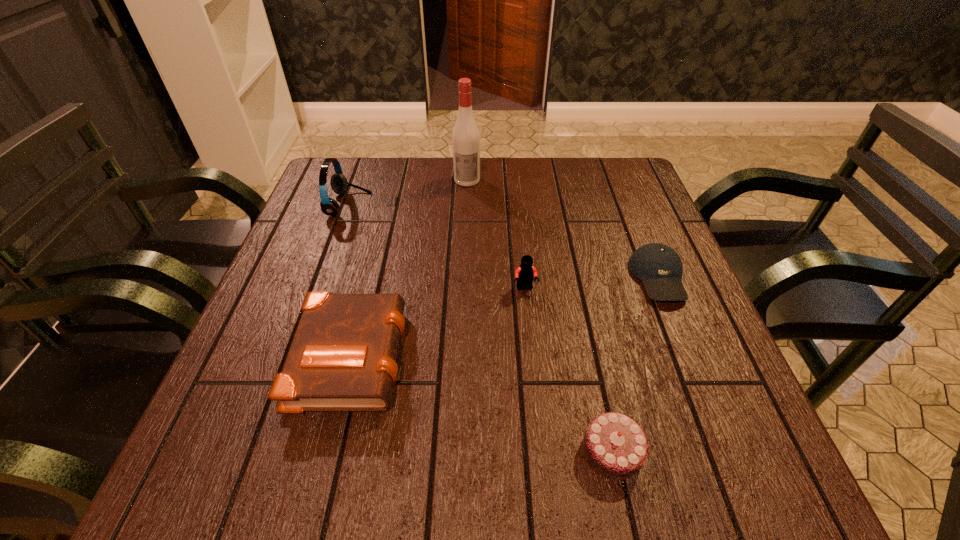
Where is `vacant space located on the label of the farthest object`? This screenshot has width=960, height=540. vacant space located on the label of the farthest object is located at coordinates (467, 201).

Identify the location of blank space located 0.270m with the microphone attached to the side of the fifth shortest object. (468, 205).

The height and width of the screenshot is (540, 960). Identify the location of vacant space situated 0.240m on the front-facing side of the fourth shortest object. (536, 392).

Locate an element on the screen. free space located 0.340m on the spine side of the Bible is located at coordinates (579, 353).

Identify the location of free region located on the front-facing side of the rightmost object. [x=708, y=401].

At what (x,y) coordinates should I click in order to perform the action: click on vacant space located on the left of the fifth object from left to right. Please return your answer as a coordinate pair (x, y). This screenshot has height=540, width=960. Looking at the image, I should click on (491, 451).

In order to click on alcohol that is at the far edge in this screenshot , I will do `click(465, 137)`.

Locate an element on the screen. headset that is at the far edge is located at coordinates (339, 184).

Locate an element on the screen. This screenshot has width=960, height=540. object that is at the near edge is located at coordinates (615, 446).

This screenshot has height=540, width=960. Identify the location of headset that is at the left edge. (339, 184).